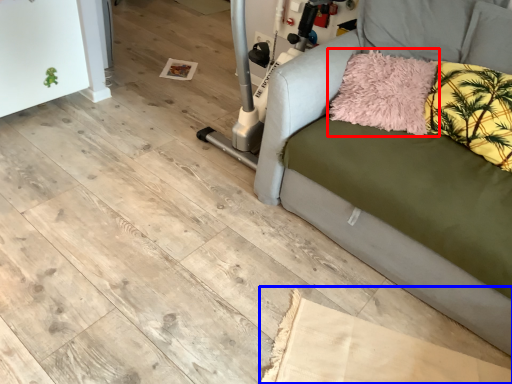
Question: Which point is closer to the camera, pillow (highlighted by a red box) or cardboard (highlighted by a blue box)?

Choices:
 (A) pillow
 (B) cardboard

Answer: (B)